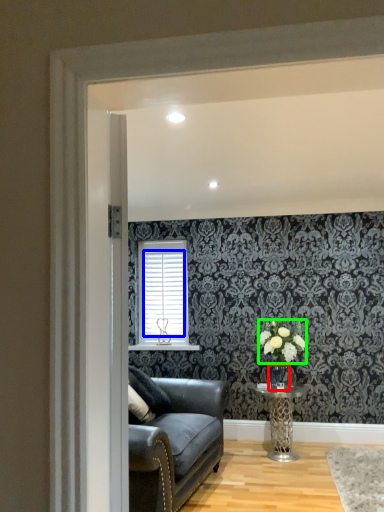
Question: Which object is the farthest from glass vase (highlighted by a red box)? Choose among these: blind (highlighted by a blue box) or flower (highlighted by a green box).

Choices:
 (A) blind
 (B) flower

Answer: (A)